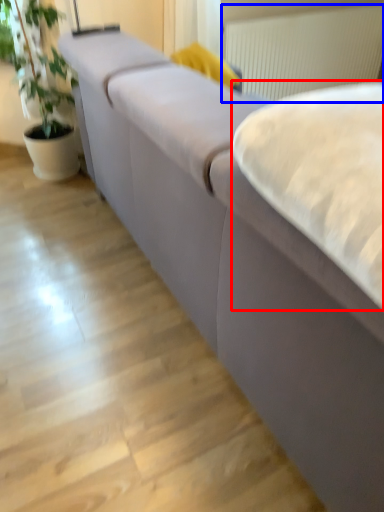
Question: Which object appears closest to the camera in this image, sheet (highlighted by a red box) or radiator (highlighted by a blue box)?

Choices:
 (A) sheet
 (B) radiator

Answer: (A)